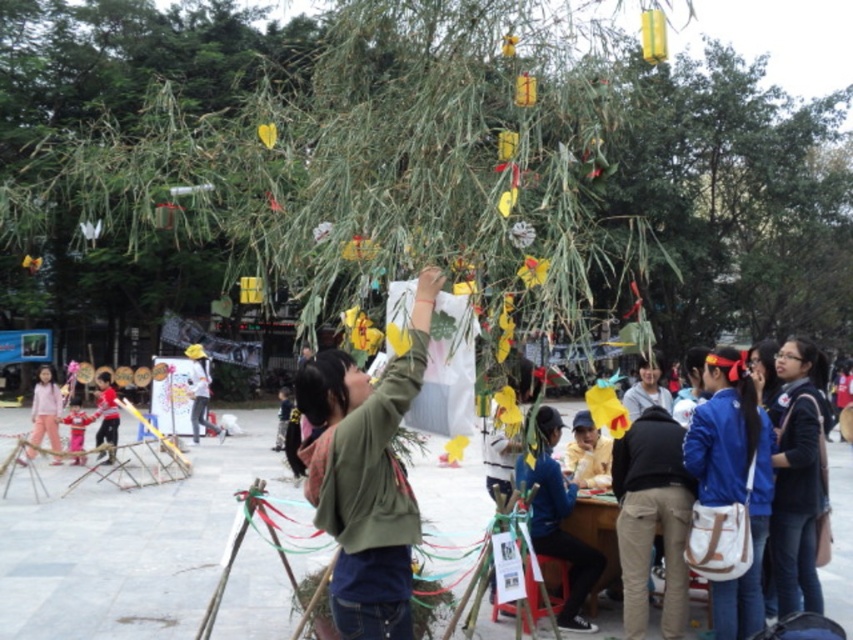
You are organizing a community event and need to decide which clothing item to use for a decoration. The light blue fabric at center and the red shirt at left are available. Which one is more suitable for hanging from the bamboo structure since it is thinner?

Result: The light blue fabric at center is thinner than the red shirt at left, so it is more suitable for hanging from the bamboo structure because its thinner material will drape better and require less support.